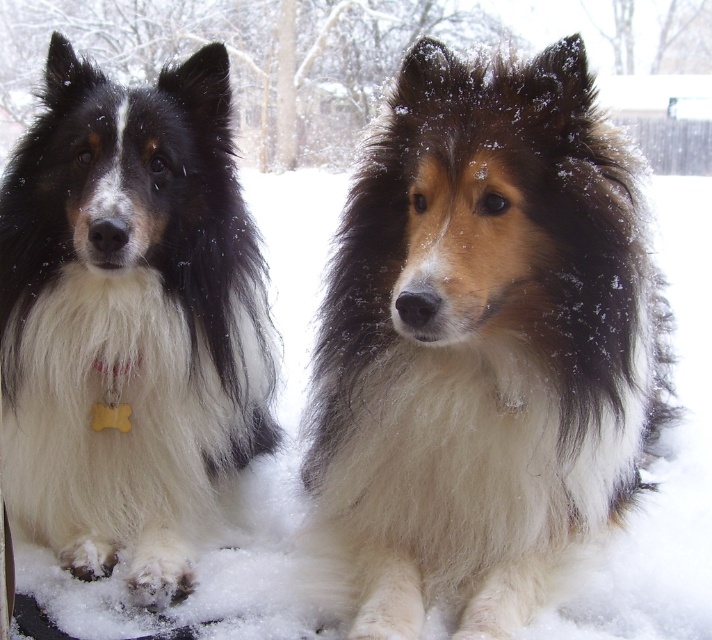
In the scene shown: Can you confirm if fluffy white dog at center is positioned to the left of fluffy white dog at left?

Incorrect, fluffy white dog at center is not on the left side of fluffy white dog at left.

Is fluffy white dog at center thinner than fluffy white dog at left?

Incorrect, fluffy white dog at center's width is not less than fluffy white dog at left's.

Where is `fluffy white dog at center`? fluffy white dog at center is located at coordinates (481, 346).